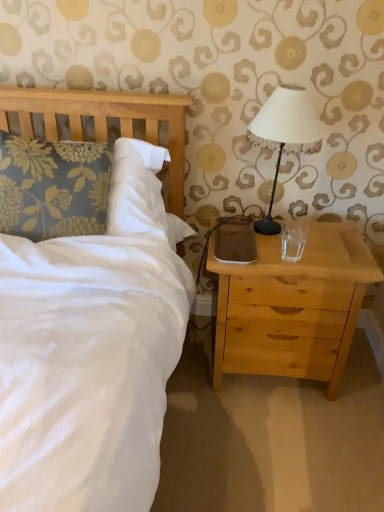
What are the coordinates of `free location above light wood nightstand at right (from a real-world perspective)` in the screenshot? It's located at (304, 241).